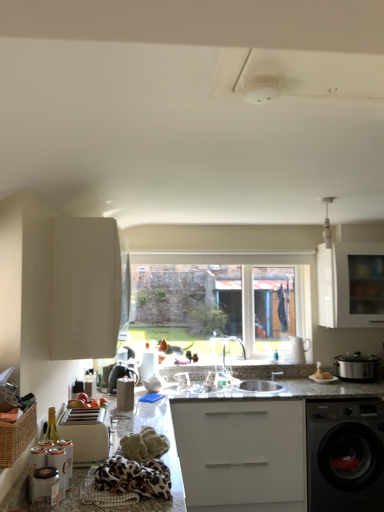
Question: Does point (66, 502) appear closer or farther from the camera than point (100, 432)?

Choices:
 (A) closer
 (B) farther

Answer: (A)

Question: Considering the positions of granite countertop at lower left, the first countertop from the left, and beige plastic toaster at lower left, the first appliance from the back, in the image, is granite countertop at lower left, the first countertop from the left, wider or thinner than beige plastic toaster at lower left, the first appliance from the back,?

Choices:
 (A) wide
 (B) thin

Answer: (A)

Question: Estimate the real-world distances between objects in this image. Which object is closer to the silver metallic tap at center?

Choices:
 (A) beige plastic toaster at lower left, which is counted as the second appliance, starting from the front
 (B) granite countertop at lower left, the first countertop from the left
 (C) black metallic washing machine at lower right
 (D) white matte bowl at lower right
 (E) woven brown basket at lower left

Answer: (D)

Question: Which is nearer to the metallic silver canister at lower left, which is counted as the 1th appliance, starting from the front?

Choices:
 (A) granite countertop at lower left, the second countertop positioned from the right
 (B) beige plastic toaster at lower left, the first appliance from the back
 (C) white glossy cabinet at upper left, the 2th cabinetry viewed from the back
 (D) white matte bowl at lower right
 (E) clear glass window at center

Answer: (B)